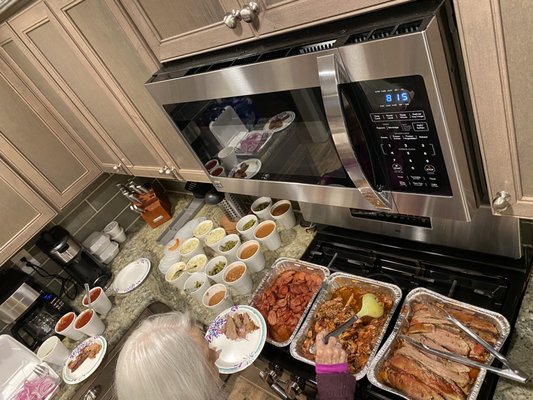
The image size is (533, 400). What are the coordinates of `stove` in the screenshot? It's located at (477, 233).